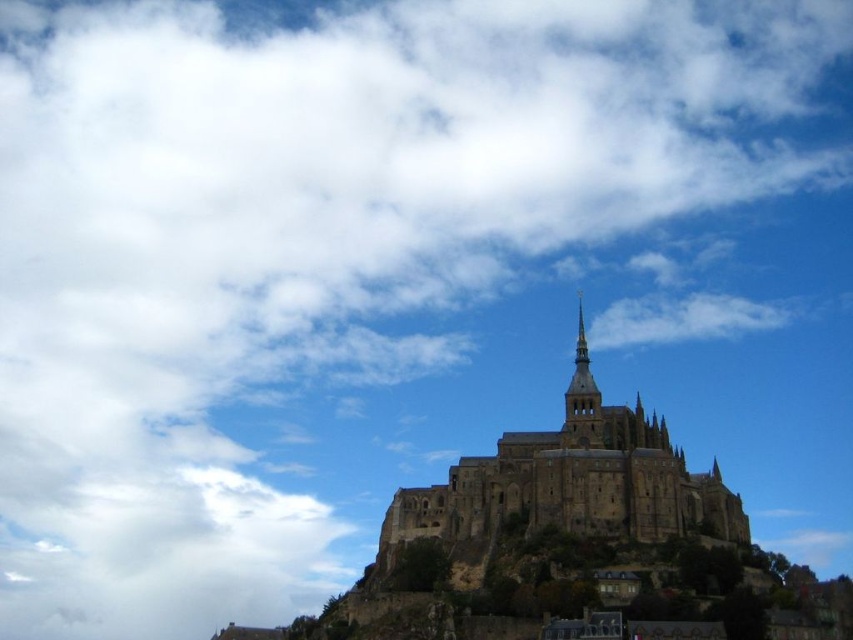
You are standing at the base of the medieval tower and want to reach the point marked at coordinate point (595, 522). Given that your maximum walking distance is 100 meters, can you reach it without exceeding your limit?

The distance between you and the point marked at coordinate point (595, 522) is 116.56 meters, which exceeds your maximum walking distance of 100 meters. Therefore, you cannot reach it without exceeding your limit.

You are a medieval architect examining the brown stone castle at center and the golden stone spire at center. Which structure would require a taller ladder to reach its highest point?

The brown stone castle at center is much taller than the golden stone spire at center, so you would need a taller ladder to reach its highest point.

You are a tourist standing at the base of the hill looking at the brown stone castle at center. You want to take a photo that captures the entire castle in the frame. Based on the distance, do you think you can fit the entire castle into your camera view without moving closer? Please explain your reasoning.

The brown stone castle at center is 112.93 meters away from the camera. At this distance, it is likely that the entire castle can be captured in the camera view without needing to move closer, as most standard camera lenses can accommodate such distances for wide shots.